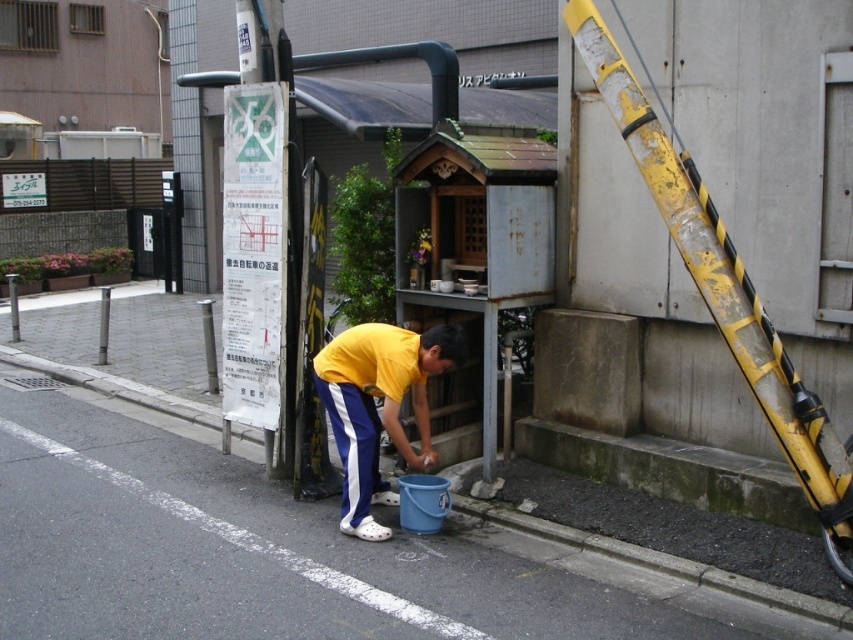
Question: Which of the following is the farthest from the observer?

Choices:
 (A) yellow matte/suede shirt at center
 (B) blue plastic bucket at lower center

Answer: (A)

Question: Which object appears closest to the camera in this image?

Choices:
 (A) yellow matte/suede shirt at center
 (B) blue plastic bucket at lower center

Answer: (B)

Question: Does blue plastic bucket at lower center have a greater width compared to yellow matte/suede shirt at center?

Choices:
 (A) no
 (B) yes

Answer: (B)

Question: Can you confirm if blue plastic bucket at lower center is thinner than yellow matte/suede shirt at center?

Choices:
 (A) yes
 (B) no

Answer: (B)

Question: Does blue plastic bucket at lower center lie behind yellow matte/suede shirt at center?

Choices:
 (A) yes
 (B) no

Answer: (B)